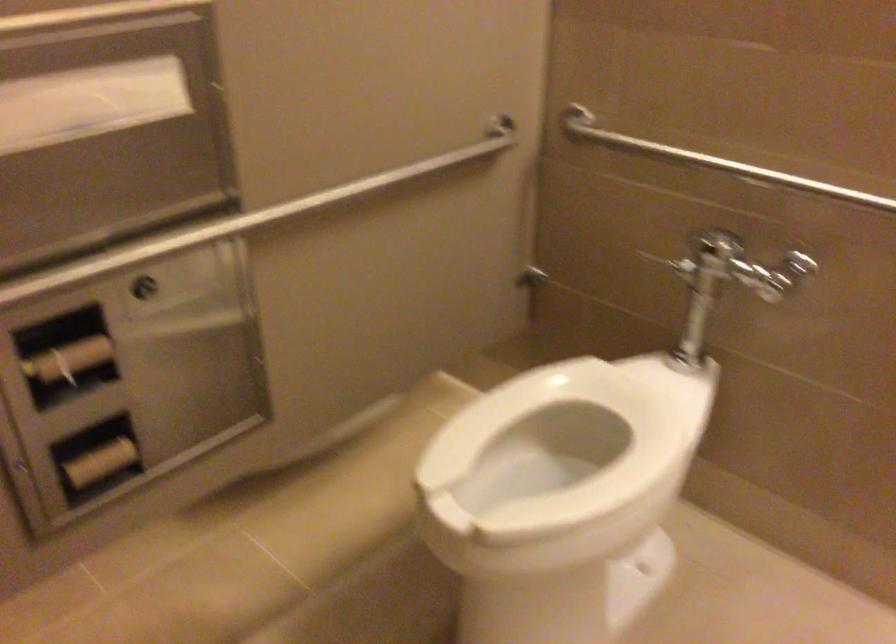
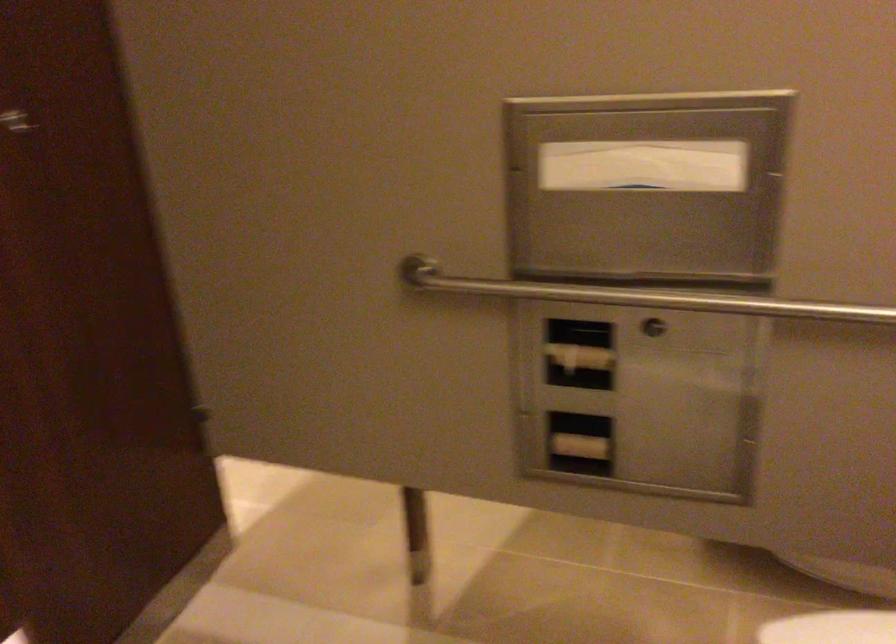
In the second image, find the point that corresponds to the point at 104,460 in the first image.

(580, 446)